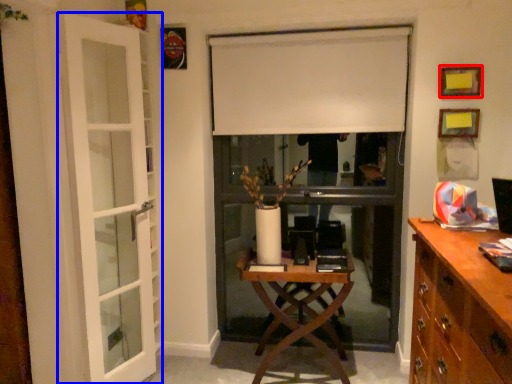
Question: Which of the following is the closest to the observer, picture frame (highlighted by a red box) or door (highlighted by a blue box)?

Choices:
 (A) picture frame
 (B) door

Answer: (B)